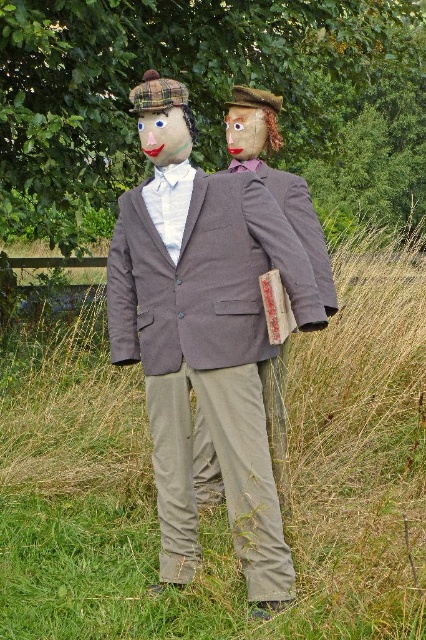
From the picture: You are a tailor measuring two items for repair in the image. The items are the matte brown suit at center and the matte brown mask at center. Which item has a greater width?

The matte brown suit at center has a greater width than the matte brown mask at center.

You are a farmer checking the scarecrows in your field. You notice the matte gray suit at center and the matte brown mask at center. Which object is positioned lower in the image?

The matte gray suit at center is located below the matte brown mask at center, so the matte gray suit at center is positioned lower in the image.